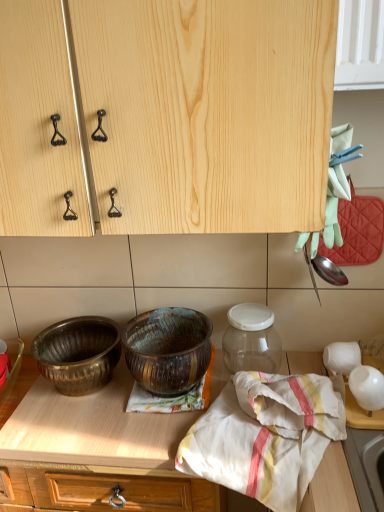
Question: Is rusty metallic bowl at center, the 1th bowl in the right-to-left sequence, in front of white cotton cloth at center?

Choices:
 (A) no
 (B) yes

Answer: (A)

Question: Can you confirm if rusty metallic bowl at center, the 1th bowl in the right-to-left sequence, is positioned to the left of white cotton cloth at center?

Choices:
 (A) no
 (B) yes

Answer: (B)

Question: Does rusty metallic bowl at center, the 1th bowl in the right-to-left sequence, have a larger size compared to white cotton cloth at center?

Choices:
 (A) yes
 (B) no

Answer: (B)

Question: Is rusty metallic bowl at center, the 1th bowl in the right-to-left sequence, taller than white cotton cloth at center?

Choices:
 (A) no
 (B) yes

Answer: (A)

Question: From the image's perspective, is rusty metallic bowl at center, the 1th bowl in the right-to-left sequence, over white cotton cloth at center?

Choices:
 (A) yes
 (B) no

Answer: (A)

Question: Visually, is natural wood cabinet at upper center positioned to the left or to the right of white cotton cloth at center?

Choices:
 (A) left
 (B) right

Answer: (A)

Question: Is natural wood cabinet at upper center inside or outside of white cotton cloth at center?

Choices:
 (A) outside
 (B) inside

Answer: (A)

Question: Is natural wood cabinet at upper center in front of or behind white cotton cloth at center in the image?

Choices:
 (A) front
 (B) behind

Answer: (A)

Question: In terms of height, does natural wood cabinet at upper center look taller or shorter compared to white cotton cloth at center?

Choices:
 (A) tall
 (B) short

Answer: (A)

Question: From the image's perspective, is white cotton cloth at center above or below natural wood cabinet at upper center?

Choices:
 (A) below
 (B) above

Answer: (A)

Question: Is white cotton cloth at center bigger or smaller than natural wood cabinet at upper center?

Choices:
 (A) big
 (B) small

Answer: (B)

Question: From a real-world perspective, is white cotton cloth at center positioned above or below natural wood cabinet at upper center?

Choices:
 (A) below
 (B) above

Answer: (A)

Question: From their relative heights in the image, would you say white cotton cloth at center is taller or shorter than natural wood cabinet at upper center?

Choices:
 (A) tall
 (B) short

Answer: (B)

Question: Considering the positions of point (201, 334) and point (76, 360), is point (201, 334) closer or farther from the camera than point (76, 360)?

Choices:
 (A) farther
 (B) closer

Answer: (B)

Question: Is rusty metallic bowl at center, placed as the 2th bowl when sorted from left to right, in front of or behind polished brass bowl at lower left, which is the second bowl from right to left, in the image?

Choices:
 (A) front
 (B) behind

Answer: (A)